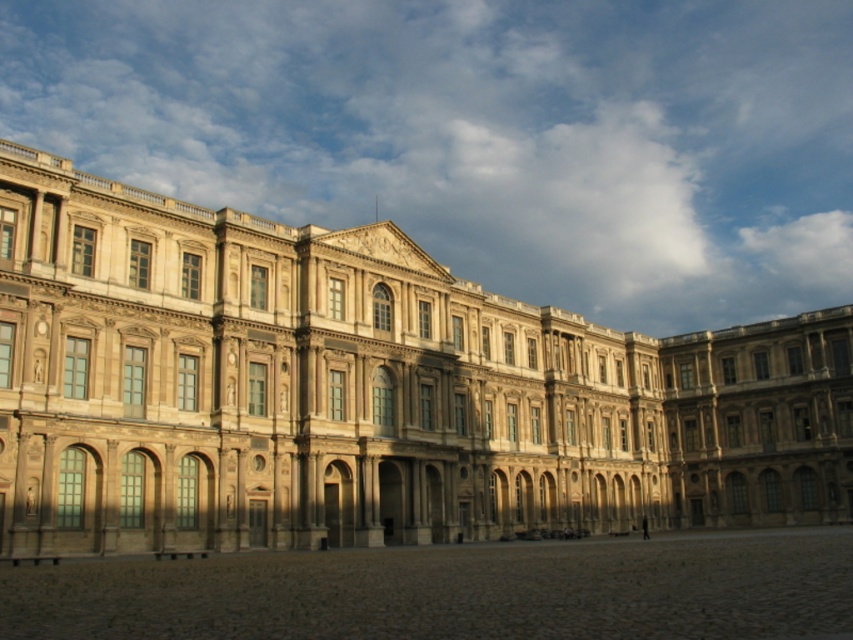
Question: Does beige stone palace at center lie behind brown stone courtyard at lower center?

Choices:
 (A) yes
 (B) no

Answer: (A)

Question: Does beige stone palace at center appear on the left side of brown stone courtyard at lower center?

Choices:
 (A) no
 (B) yes

Answer: (B)

Question: Which object appears closest to the camera in this image?

Choices:
 (A) brown stone courtyard at lower center
 (B) beige stone palace at center

Answer: (A)

Question: Observing the image, what is the correct spatial positioning of beige stone palace at center in reference to brown stone courtyard at lower center?

Choices:
 (A) above
 (B) below

Answer: (A)